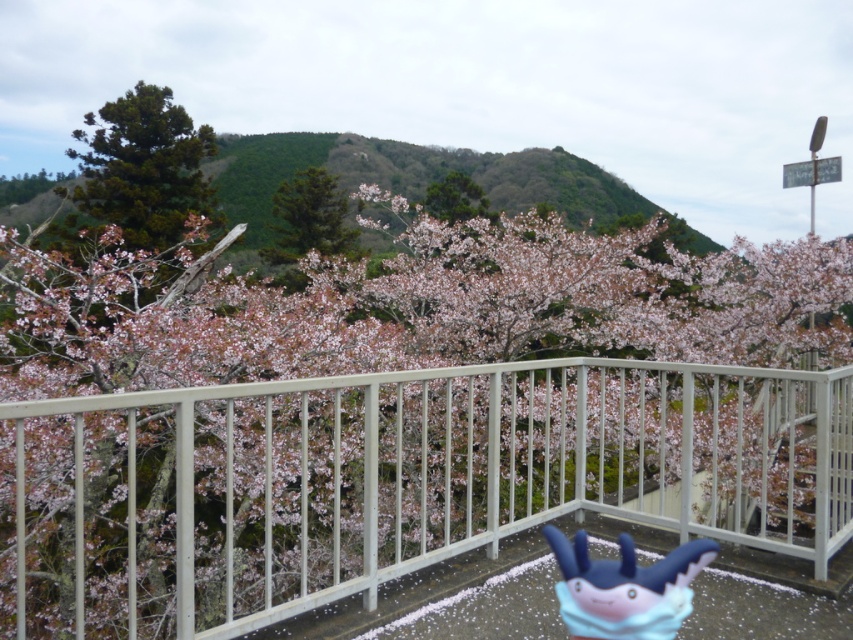
From the picture: Between white metal railing at center and green matte tree at upper center, which one is positioned higher?

green matte tree at upper center

The width and height of the screenshot is (853, 640). Describe the element at coordinates (392, 481) in the screenshot. I see `white metal railing at center` at that location.

Between point (802, 554) and point (485, 214), which one is positioned in front?

Point (802, 554) is more forward.

Where is `white metal railing at center`? This screenshot has height=640, width=853. white metal railing at center is located at coordinates (392, 481).

Is point (656, 573) more distant than point (456, 184)?

No, (656, 573) is closer to viewer.

Which is more to the right, blue rubber toy at center or green matte tree at upper center?

blue rubber toy at center is more to the right.

You are a GUI agent. You are given a task and a screenshot of the screen. Output one action in this format:
    pyautogui.click(x=<x>, y=<y>)
    Task: Click on the blue rubber toy at center
    The width and height of the screenshot is (853, 640).
    Given the screenshot: What is the action you would take?
    pyautogui.click(x=625, y=588)

Does point (572, 627) lie behind point (297, 228)?

No.

Between blue rubber toy at center and green matte tree at center, which one is positioned lower?

blue rubber toy at center is lower down.

Is point (674, 580) more distant than point (343, 216)?

No, it is in front of (343, 216).

Where is `blue rubber toy at center`? This screenshot has height=640, width=853. blue rubber toy at center is located at coordinates (625, 588).